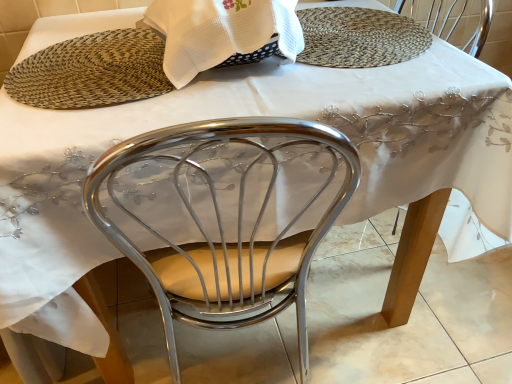
Question: Considering their positions, is woven mat at upper center located in front of or behind woven straw placemat at upper center?

Choices:
 (A) front
 (B) behind

Answer: (A)

Question: Based on their positions, is woven mat at upper center located to the left or right of woven straw placemat at upper center?

Choices:
 (A) right
 (B) left

Answer: (B)

Question: Which of these objects is positioned farthest from the woven mat at upper center?

Choices:
 (A) white woven cloth at upper center
 (B) woven straw placemat at upper center

Answer: (B)

Question: Considering the real-world distances, which object is farthest from the white woven cloth at upper center?

Choices:
 (A) woven straw placemat at upper center
 (B) woven mat at upper center

Answer: (A)